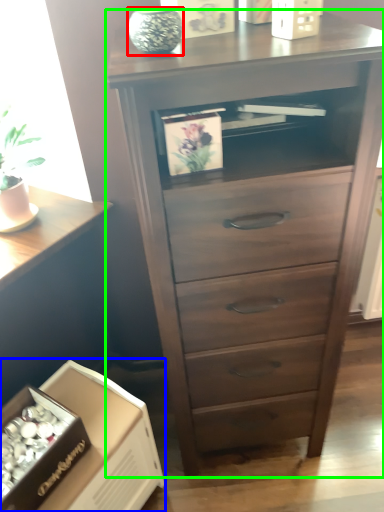
Question: Which is nearer to the glass vase (highlighted by a red box)? cardboard box (highlighted by a blue box) or chest of drawers (highlighted by a green box).

Choices:
 (A) cardboard box
 (B) chest of drawers

Answer: (B)